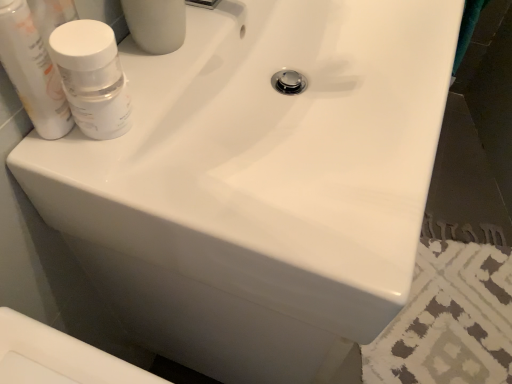
Question: In the image, is white matte bottle at upper left, which is counted as the 1th mouthwash, starting from the right, positioned in front of or behind white glossy bottle at upper left, acting as the 1th mouthwash starting from the left?

Choices:
 (A) front
 (B) behind

Answer: (B)

Question: From the image's perspective, is white matte bottle at upper left, acting as the second mouthwash starting from the left, positioned above or below white glossy bottle at upper left, the 2th mouthwash from the right?

Choices:
 (A) below
 (B) above

Answer: (A)

Question: Would you say white matte bottle at upper left, which is counted as the 1th mouthwash, starting from the right, is to the left or to the right of white glossy bottle at upper left, the 2th mouthwash from the right, in the picture?

Choices:
 (A) right
 (B) left

Answer: (A)

Question: Would you say white glossy bottle at upper left, acting as the 1th mouthwash starting from the left, is to the left or to the right of white matte bottle at upper left, acting as the second mouthwash starting from the left, in the picture?

Choices:
 (A) right
 (B) left

Answer: (B)

Question: Is white glossy bottle at upper left, the 2th mouthwash from the right, inside the boundaries of white matte bottle at upper left, acting as the second mouthwash starting from the left, or outside?

Choices:
 (A) outside
 (B) inside

Answer: (A)

Question: In terms of height, does white glossy bottle at upper left, the 2th mouthwash from the right, look taller or shorter compared to white matte bottle at upper left, which is counted as the 1th mouthwash, starting from the right?

Choices:
 (A) tall
 (B) short

Answer: (A)

Question: Considering the positions of white glossy bottle at upper left, the 2th mouthwash from the right, and white matte bottle at upper left, which is counted as the 1th mouthwash, starting from the right, in the image, is white glossy bottle at upper left, the 2th mouthwash from the right, wider or thinner than white matte bottle at upper left, which is counted as the 1th mouthwash, starting from the right,?

Choices:
 (A) wide
 (B) thin

Answer: (B)